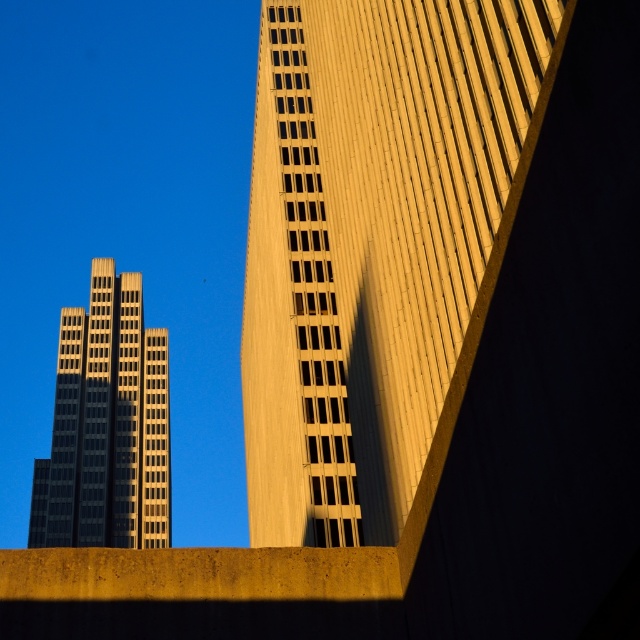
Question: Can you confirm if golden concrete building at upper right is positioned to the right of matte gold skyscraper at left?

Choices:
 (A) no
 (B) yes

Answer: (B)

Question: In this image, where is golden concrete building at upper right located relative to matte gold skyscraper at left?

Choices:
 (A) left
 (B) right

Answer: (B)

Question: Which object appears closest to the camera in this image?

Choices:
 (A) golden concrete building at upper right
 (B) matte gold skyscraper at left

Answer: (A)

Question: Is golden concrete building at upper right smaller than matte gold skyscraper at left?

Choices:
 (A) no
 (B) yes

Answer: (A)

Question: Among these points, which one is farthest from the camera?

Choices:
 (A) (394, 346)
 (B) (65, 403)

Answer: (B)